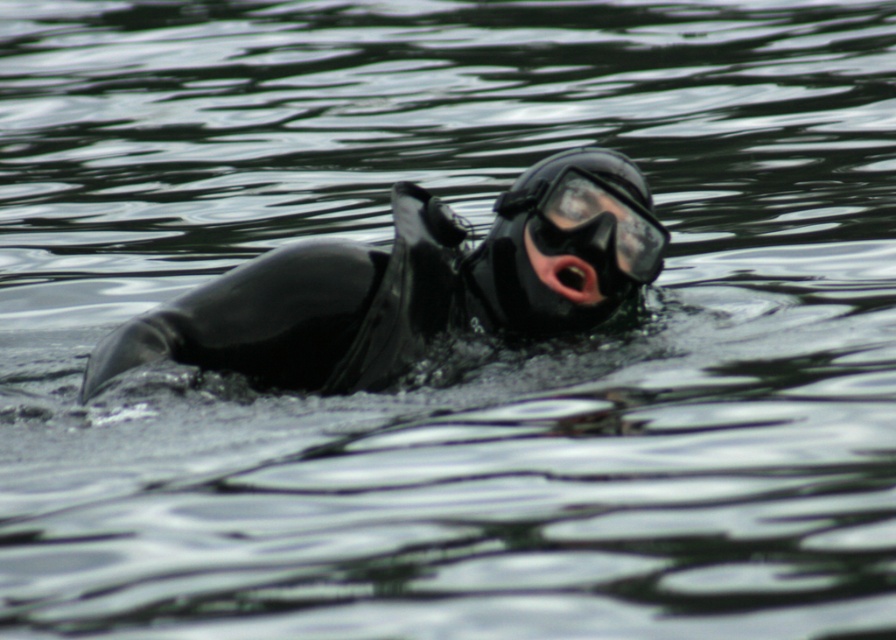
Does black rubber diver at center appear on the left side of pink matte skin at center?

Indeed, black rubber diver at center is positioned on the left side of pink matte skin at center.

Is point (638, 173) less distant than point (532, 266)?

Yes, point (638, 173) is in front of point (532, 266).

I want to click on black rubber diver at center, so click(406, 284).

Can you confirm if black rubber diver at center is thinner than black matte/glossy mask at center?

No.

Is black rubber diver at center below black matte/glossy mask at center?

Yes, black rubber diver at center is below black matte/glossy mask at center.

Who is more distant from viewer, (269, 369) or (661, 262)?

The point (661, 262) is behind.

Identify the location of black rubber diver at center. This screenshot has width=896, height=640. tap(406, 284).

Is black matte/glossy mask at center wider than pink matte skin at center?

Yes.

Does black matte/glossy mask at center have a greater height compared to pink matte skin at center?

Yes, black matte/glossy mask at center is taller than pink matte skin at center.

Describe the element at coordinates (591, 227) in the screenshot. The height and width of the screenshot is (640, 896). I see `black matte/glossy mask at center` at that location.

Locate an element on the screen. This screenshot has height=640, width=896. black matte/glossy mask at center is located at coordinates (591, 227).